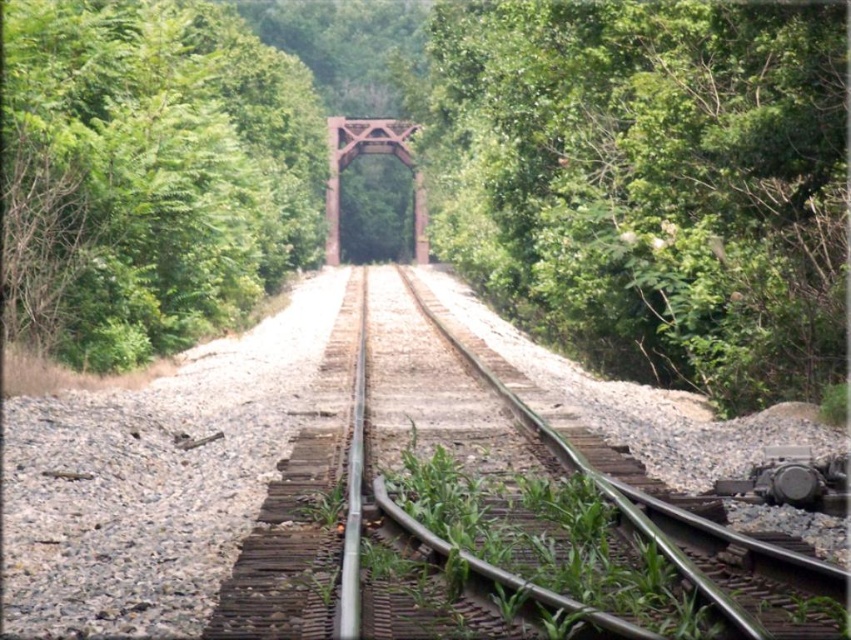
Between green leafy tree at center and rusty metal train bridge at center, which one has more height?

green leafy tree at center

Is green leafy tree at center closer to camera compared to rusty metal train bridge at center?

Yes, green leafy tree at center is closer to the viewer.

Measure the distance between green leafy tree at center and camera.

They are 11.20 meters apart.

Locate an element on the screen. green leafy tree at center is located at coordinates click(650, 182).

Is green leafy tree at center positioned in front of metallic train track at center?

No, green leafy tree at center is behind metallic train track at center.

Describe the element at coordinates (650, 182) in the screenshot. The height and width of the screenshot is (640, 851). I see `green leafy tree at center` at that location.

Image resolution: width=851 pixels, height=640 pixels. I want to click on green leafy tree at center, so click(650, 182).

Between green leafy tree at left and rusty metal train bridge at center, which one is positioned lower?

green leafy tree at left is below.

Can you confirm if green leafy tree at left is positioned below rusty metal train bridge at center?

Correct, green leafy tree at left is located below rusty metal train bridge at center.

Identify the location of green leafy tree at left. This screenshot has height=640, width=851. (150, 173).